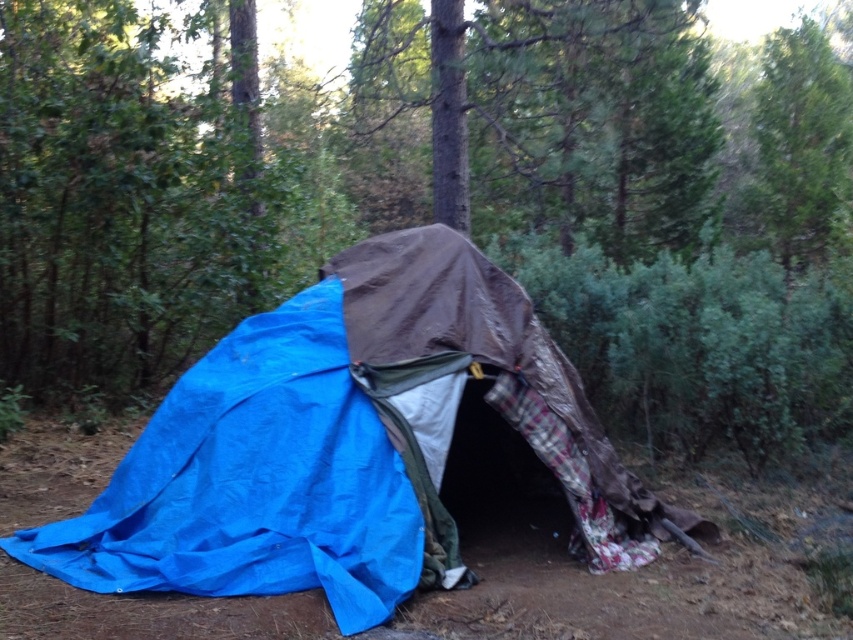
You are setting up a tent in the forest and notice the blue tarp at center and the green leafy tree at upper right. Which object is positioned higher in the image?

The green leafy tree at upper right is positioned higher in the image than the blue tarp at center.

You are setting up a campsite and have to choose between placing your tent under the blue tarp at center or near the green leafy tree at upper right. Based on their sizes, which location would provide more space for your tent?

The green leafy tree at upper right is larger than the blue tarp at center, so placing your tent near the green leafy tree at upper right would provide more space for your tent.

You are setting up a tent in the forest and need to place a blue tarp at center. Where should you place it relative to the other objects in the shelter?

The blue tarp at center should be placed at the coordinates point (349, 444) as specified in the description.